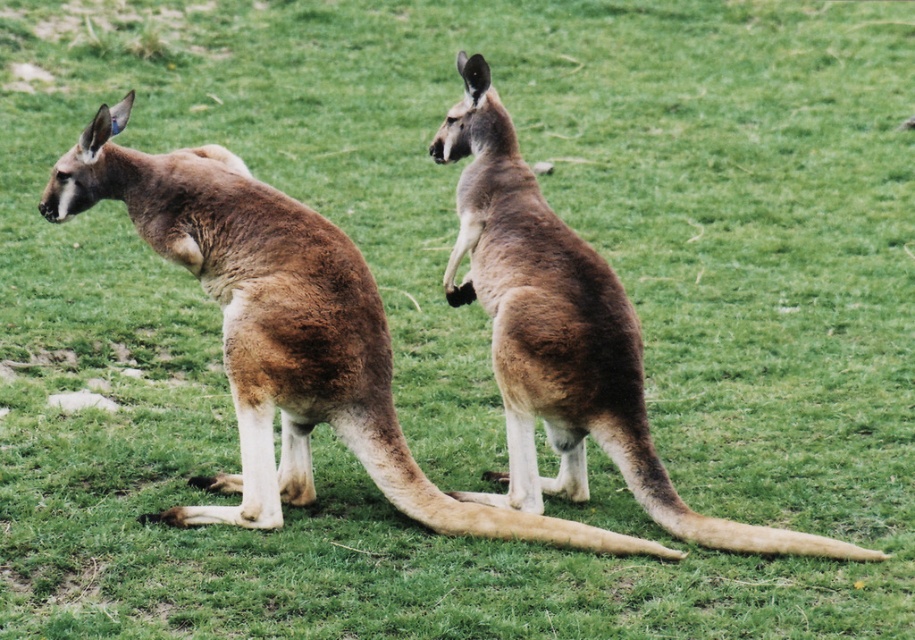
Can you confirm if brown furry kangaroo at left is positioned to the right of brown furry kangaroo at center?

In fact, brown furry kangaroo at left is to the left of brown furry kangaroo at center.

Based on the photo, is brown furry kangaroo at left taller than brown furry kangaroo at center?

No, brown furry kangaroo at left is not taller than brown furry kangaroo at center.

Is point (268, 500) positioned in front of point (451, 289)?

Yes, point (268, 500) is in front of point (451, 289).

Image resolution: width=915 pixels, height=640 pixels. I want to click on brown furry kangaroo at left, so click(283, 333).